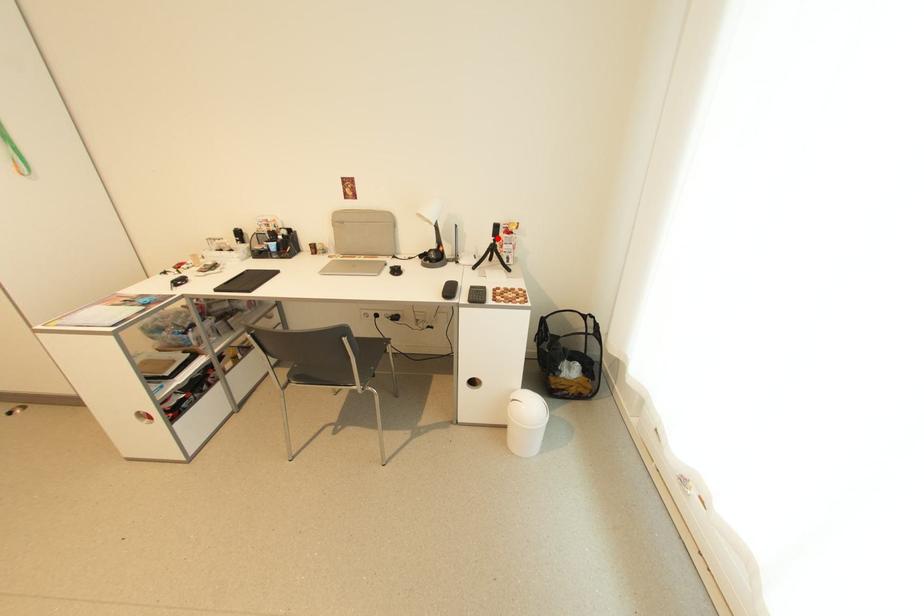
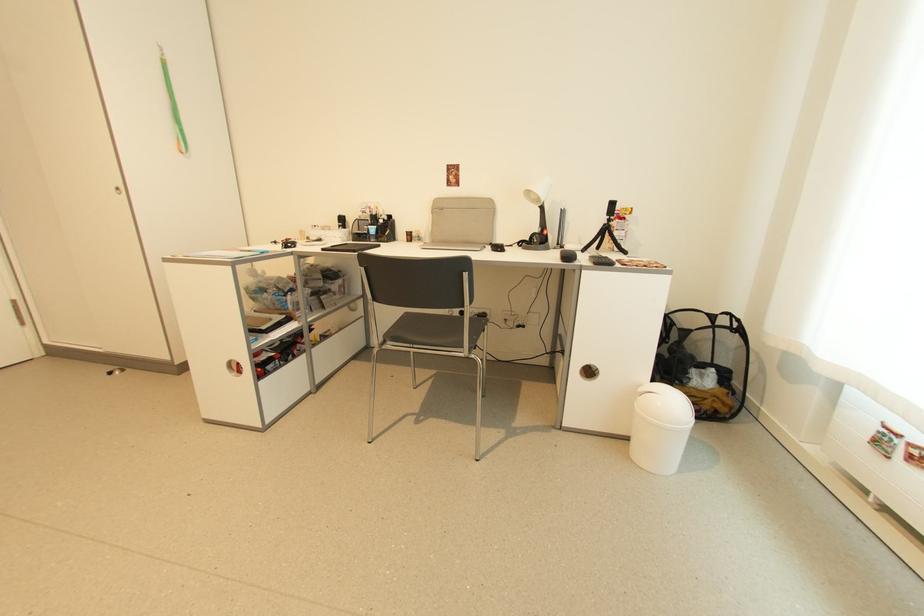
Question: I am providing you with two images of the same scene from different viewpoints. A red point is marked on the first image. At the location where the point appears in image 1, is it still visible in image 2?

Choices:
 (A) Yes
 (B) No

Answer: (A)